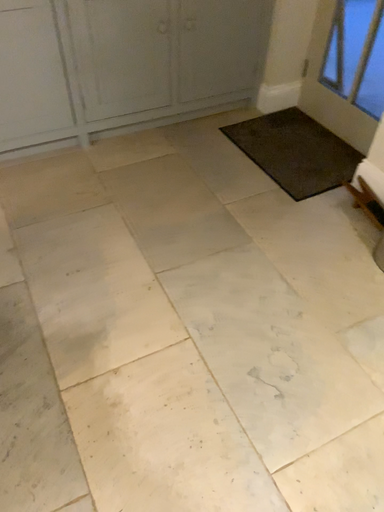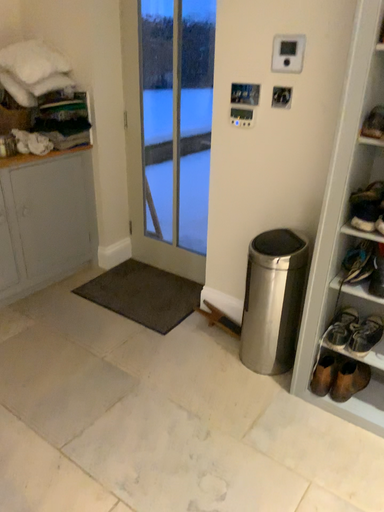
Question: Which way did the camera rotate in the video?

Choices:
 (A) rotated left
 (B) rotated right

Answer: (B)